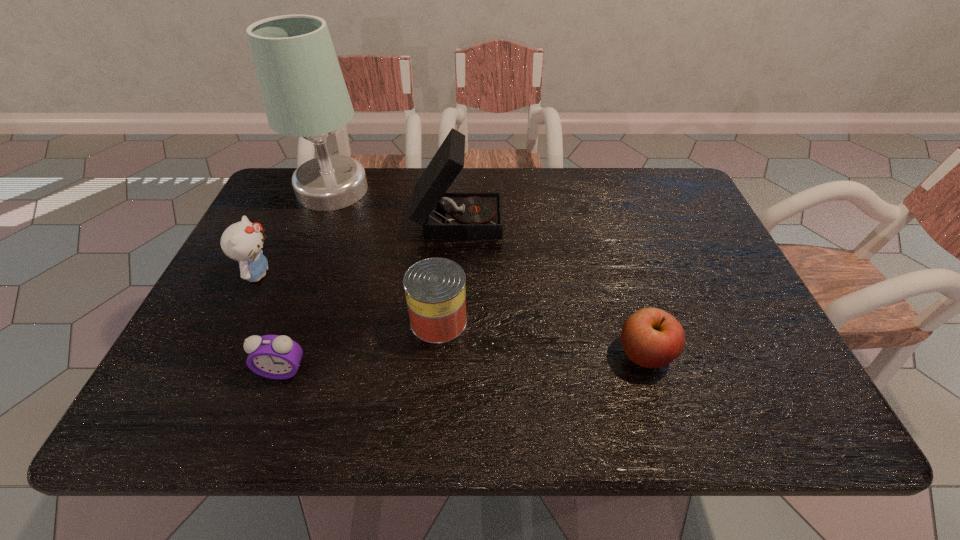
Image resolution: width=960 pixels, height=540 pixels. Identify the location of blank space located 0.290m on the left of the rightmost object. (477, 353).

Identify the location of lampshade that is positioned at the far edge. (304, 93).

The height and width of the screenshot is (540, 960). In order to click on phonograph_record at the far edge in this screenshot , I will do `click(442, 215)`.

Locate an element on the screen. lampshade situated at the left edge is located at coordinates (304, 93).

I want to click on kitten that is positioned at the left edge, so click(242, 241).

What are the coordinates of `object that is positioned at the far left corner` in the screenshot? It's located at (304, 93).

What are the coordinates of `vacant space at the far edge of the desktop` in the screenshot? It's located at click(602, 172).

You are a GUI agent. You are given a task and a screenshot of the screen. Output one action in this format:
    pyautogui.click(x=<x>, y=<y>)
    Task: Click on the vacant space at the near edge of the desktop
    Image resolution: width=960 pixels, height=540 pixels.
    Given the screenshot: What is the action you would take?
    pyautogui.click(x=478, y=422)

Image resolution: width=960 pixels, height=540 pixels. I want to click on free location at the left edge of the desktop, so (x=311, y=223).

At what (x,y) coordinates should I click in order to perform the action: click on vacant area at the right edge. Please return your answer as a coordinate pair (x, y). Image resolution: width=960 pixels, height=540 pixels. Looking at the image, I should click on (738, 285).